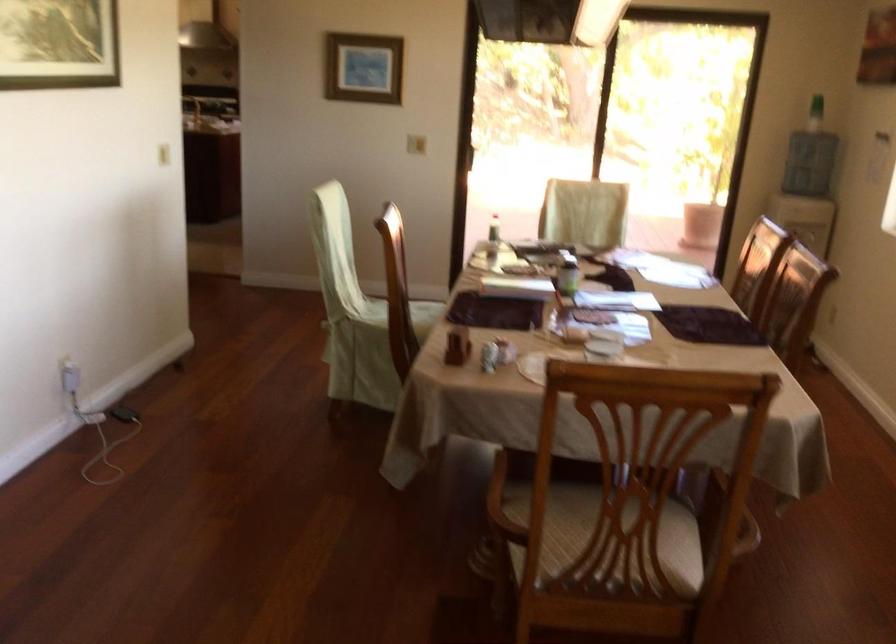
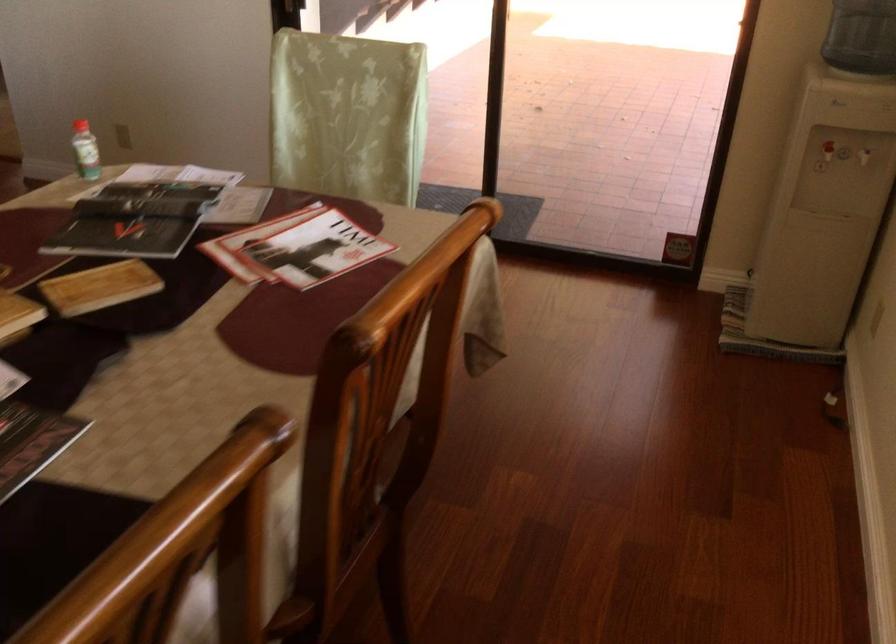
What movement of the cameraman would produce the second image?

The movement direction of the cameraman is right, forward.